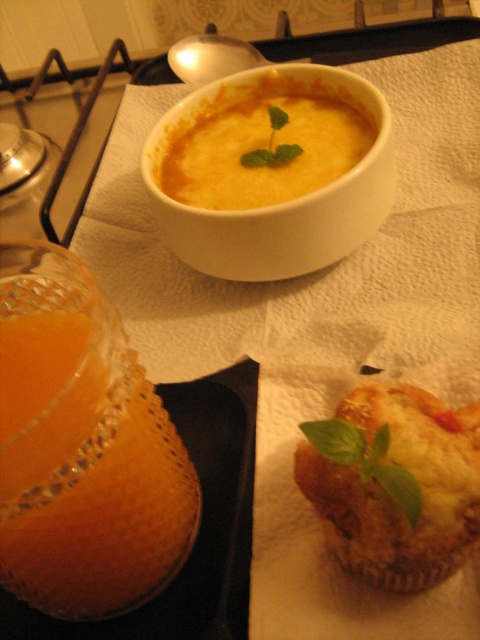
Question: Which point is closer to the camera?

Choices:
 (A) translucent glass cup of orange juice at lower left
 (B) yellow matte soup at center

Answer: (A)

Question: Can you confirm if golden brown muffin at lower right is smaller than green leafy basil at center?

Choices:
 (A) yes
 (B) no

Answer: (B)

Question: Is golden brown muffin at lower right behind yellow matte soup at center?

Choices:
 (A) yes
 (B) no

Answer: (B)

Question: Based on their relative distances, which object is farther from the green leafy basil at center?

Choices:
 (A) translucent glass cup of orange juice at lower left
 (B) yellow matte soup at center
 (C) golden brown muffin at lower right

Answer: (B)

Question: Which point appears farthest from the camera in this image?

Choices:
 (A) (305, 497)
 (B) (323, 451)
 (C) (229, 92)
 (D) (172, 540)

Answer: (C)

Question: Can you confirm if golden brown muffin at lower right is positioned to the left of yellow matte soup at center?

Choices:
 (A) no
 (B) yes

Answer: (A)